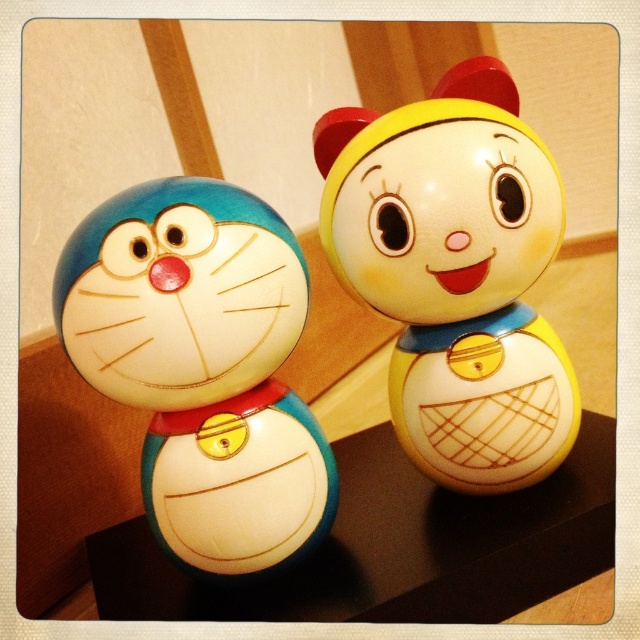
Can you confirm if glossy ceramic doll at upper right is bigger than matte ceramic cat at left?

Correct, glossy ceramic doll at upper right is larger in size than matte ceramic cat at left.

Is point (452, 461) positioned after point (212, 429)?

Yes, point (452, 461) is farther from viewer.

The width and height of the screenshot is (640, 640). I want to click on glossy ceramic doll at upper right, so click(456, 273).